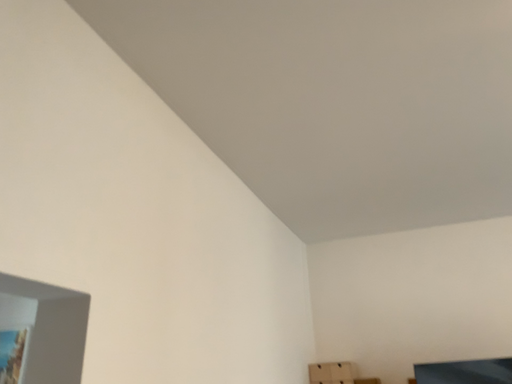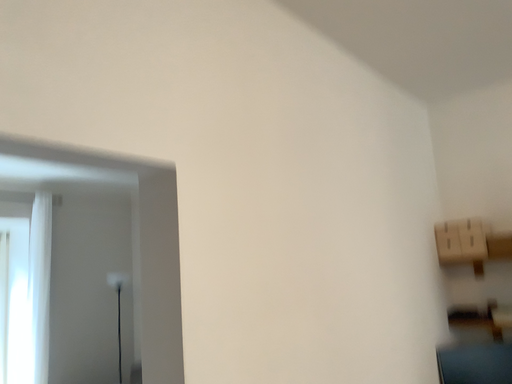
Question: Which way did the camera rotate in the video?

Choices:
 (A) rotated downward
 (B) rotated upward

Answer: (A)